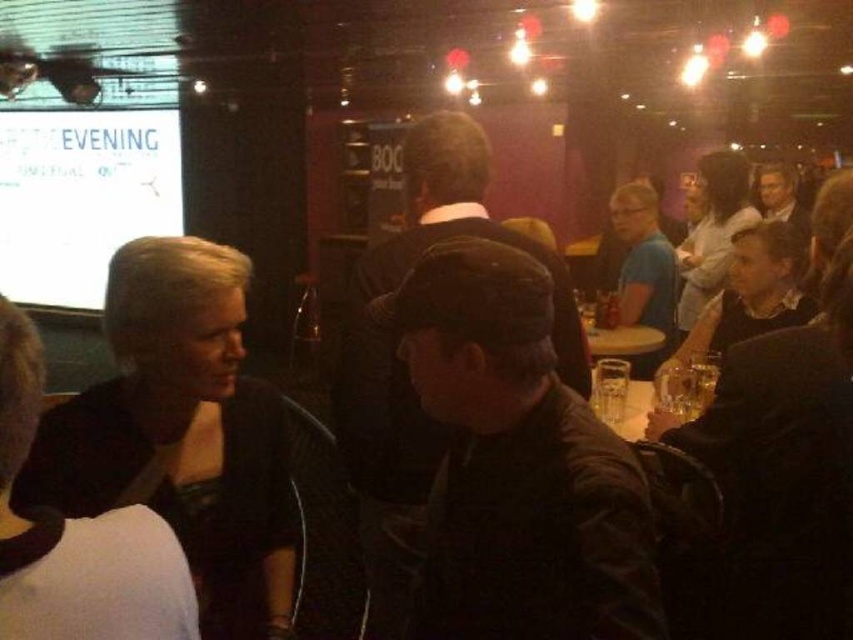
Is dark brown leather jacket at lower left wider than white glossy projection screen at upper left?

No, dark brown leather jacket at lower left is not wider than white glossy projection screen at upper left.

What do you see at coordinates (181, 433) in the screenshot? I see `dark brown leather jacket at lower left` at bounding box center [181, 433].

Image resolution: width=853 pixels, height=640 pixels. Find the location of `dark brown leather jacket at lower left`. dark brown leather jacket at lower left is located at coordinates (181, 433).